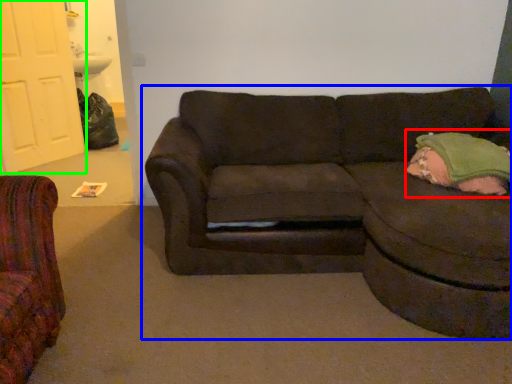
Question: Which is farther away from pillow (highlighted by a red box)? studio couch (highlighted by a blue box) or door (highlighted by a green box)?

Choices:
 (A) studio couch
 (B) door

Answer: (B)